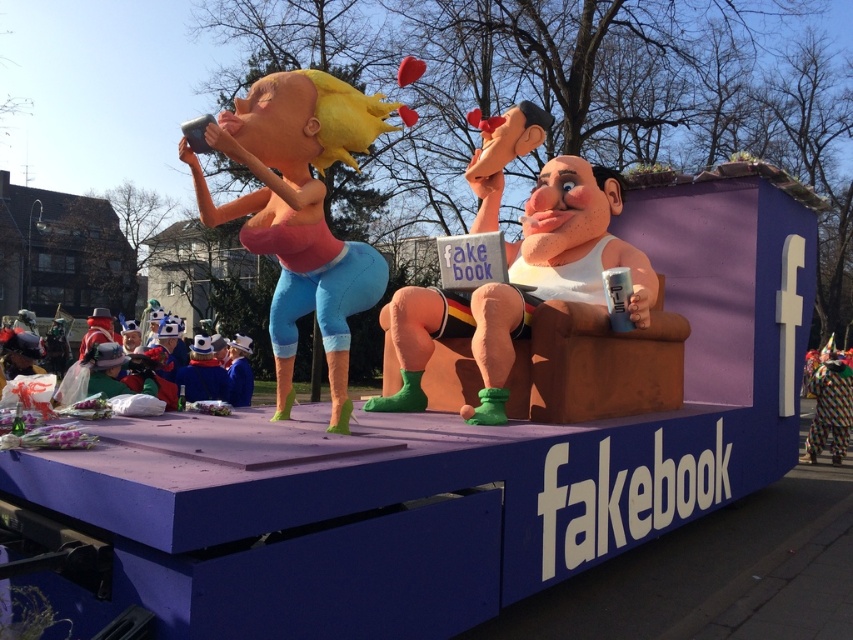
You are a photographer at the parade and want to capture the matte orange figure at left in your shot. Based on the coordinates provided, where should you position your camera to ensure the figure is centered in the frame?

The matte orange figure at left is located at coordinates point [299,211], so you should position your camera to center the frame at those coordinates to capture the figure.

In the scene shown: You are an event organizer checking the float setup. You notice the matte orange figure at left and the smooth plastic figure at center. Which figure is placed higher in the float design?

The matte orange figure at left is positioned over the smooth plastic figure at center, so it is placed higher in the float design.

You are a parade attendee standing in front of the float. You want to take a photo of both the smooth plastic figure at center and the multicolored fabric clown at lower right. Which object should you focus on first to ensure both are in frame?

The smooth plastic figure at center is larger than the multicolored fabric clown at lower right, so you should focus on the smooth plastic figure at center first to ensure both fit in the frame.